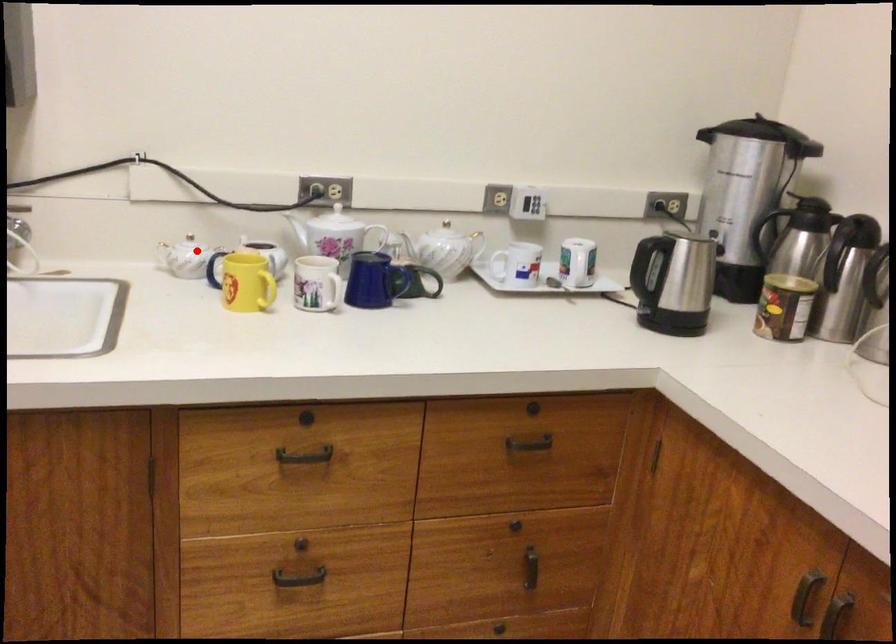
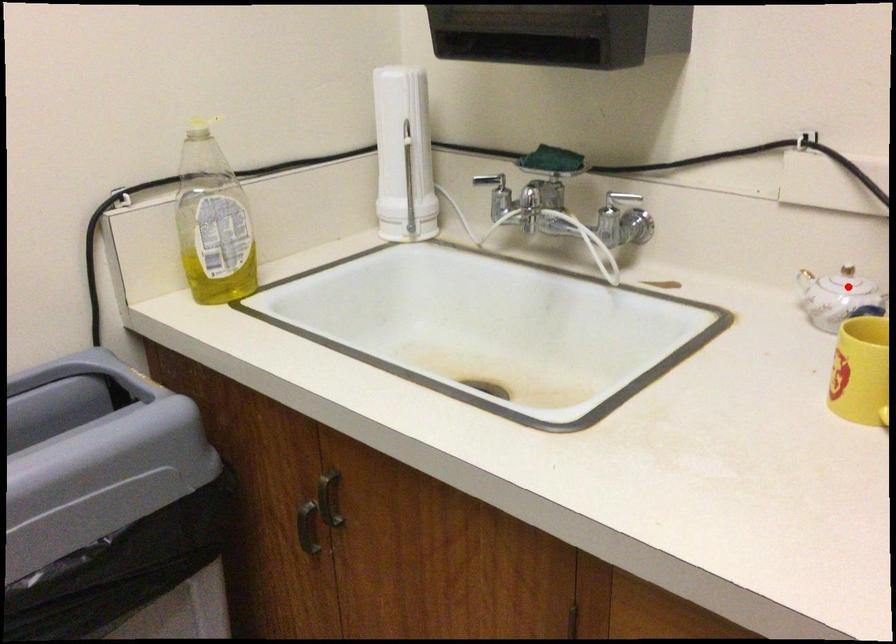
I am providing you with two images of the same scene from different viewpoints. A red point is marked on the first image and another point is marked on the second image. Are the points marked in image1 and image2 representing the same 3D position?

Yes